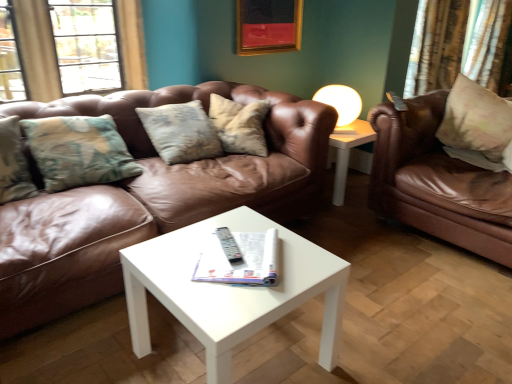
This screenshot has width=512, height=384. What are the coordinates of `spots to the right of white paper magazine at center` in the screenshot? It's located at (300, 260).